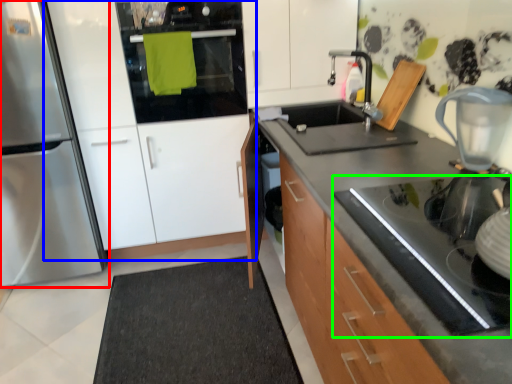
Question: Considering the real-world distances, which object is farthest from home appliance (highlighted by a red box)? cabinetry (highlighted by a blue box) or gas stove (highlighted by a green box)?

Choices:
 (A) cabinetry
 (B) gas stove

Answer: (B)